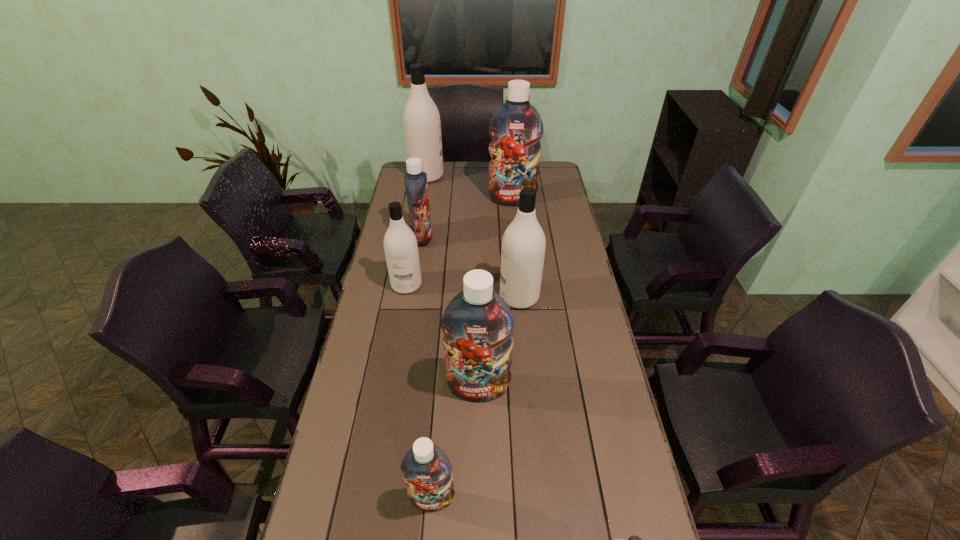
Image resolution: width=960 pixels, height=540 pixels. What are the coordinates of `the third closest blue shampoo relative to the sixth nearest object` in the screenshot? It's located at (426, 469).

Identify the location of free point that satisfies the following two spatial constraints: 1. on the front-facing side of the second white shampoo from right to left; 2. on the front label of the seventh farthest shampoo. The width and height of the screenshot is (960, 540). (538, 498).

Where is `free space in the image that satisfies the following two spatial constraints: 1. on the front-facing side of the second white shampoo from right to left; 2. on the front label of the second nearest shampoo`? free space in the image that satisfies the following two spatial constraints: 1. on the front-facing side of the second white shampoo from right to left; 2. on the front label of the second nearest shampoo is located at coordinates (538, 498).

Image resolution: width=960 pixels, height=540 pixels. What are the coordinates of `vacant space that satisfies the following two spatial constraints: 1. on the front label of the second smallest blue shampoo; 2. on the front-facing side of the second smallest white shampoo` in the screenshot? It's located at (415, 285).

In order to click on free space that satisfies the following two spatial constraints: 1. on the front-facing side of the farthest shampoo; 2. on the front-facing side of the second smallest white shampoo in this screenshot , I will do `click(408, 285)`.